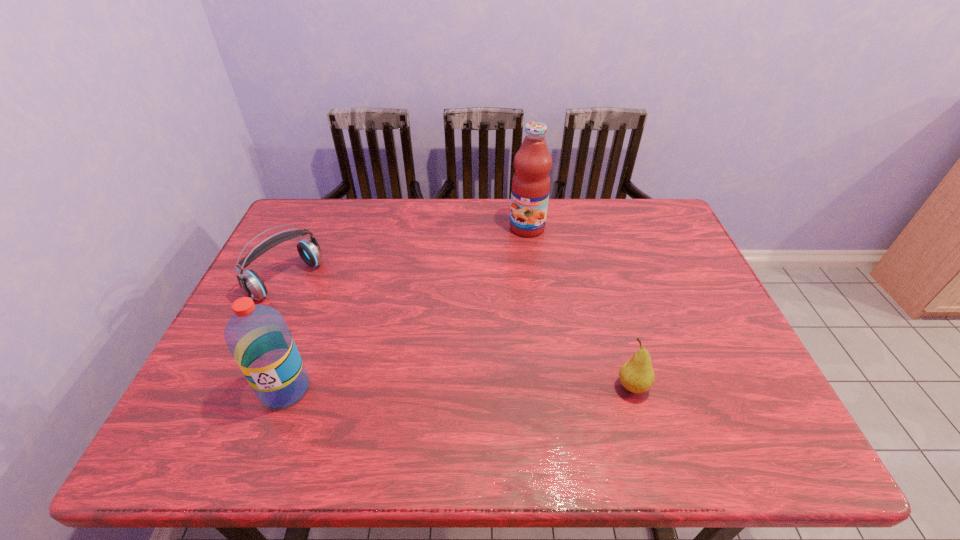
Identify the location of free region at the right edge. (688, 279).

Image resolution: width=960 pixels, height=540 pixels. I want to click on vacant area at the far left corner of the desktop, so click(x=331, y=226).

Locate an element on the screen. free space at the far right corner is located at coordinates (621, 200).

You are a GUI agent. You are given a task and a screenshot of the screen. Output one action in this format:
    pyautogui.click(x=<x>, y=<y>)
    Task: Click on the free spot between the second tallest object and the second object from right to left
    
    Given the screenshot: What is the action you would take?
    pyautogui.click(x=406, y=308)

Where is `free space between the pear and the farthest object`? Image resolution: width=960 pixels, height=540 pixels. free space between the pear and the farthest object is located at coordinates 580,307.

This screenshot has height=540, width=960. I want to click on vacant region between the rightmost object and the second object from right to left, so click(580, 307).

At what (x,y) coordinates should I click in order to perform the action: click on empty space between the headset and the rightmost object. Please return your answer as a coordinate pair (x, y). Looking at the image, I should click on (460, 333).

Where is `unoccupied position between the headset and the fruit juice`? Image resolution: width=960 pixels, height=540 pixels. unoccupied position between the headset and the fruit juice is located at coordinates (407, 254).

Find the location of a particular element. The image size is (960, 540). blank region between the pear and the second tallest object is located at coordinates (459, 388).

What are the coordinates of `free space between the rightmost object and the headset` in the screenshot? It's located at (460, 333).